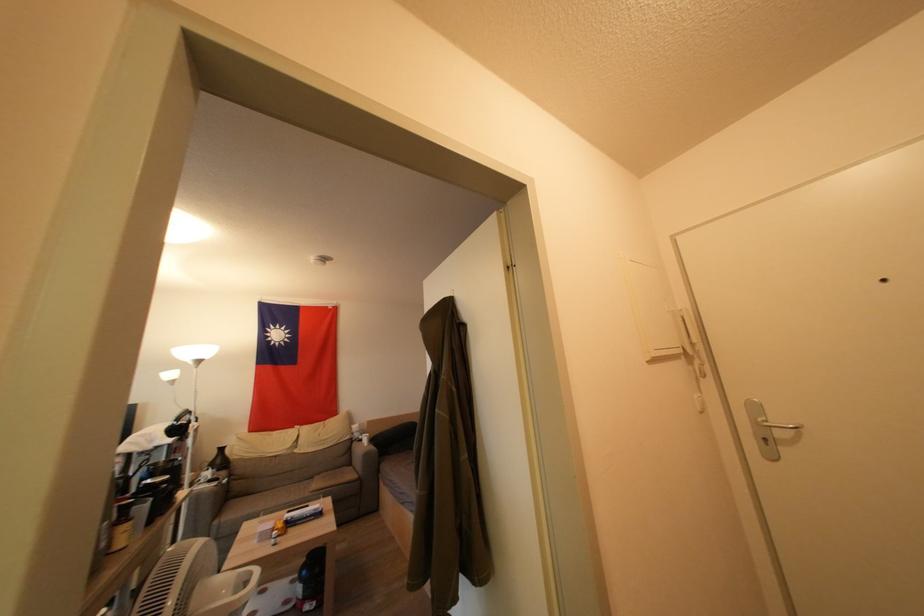
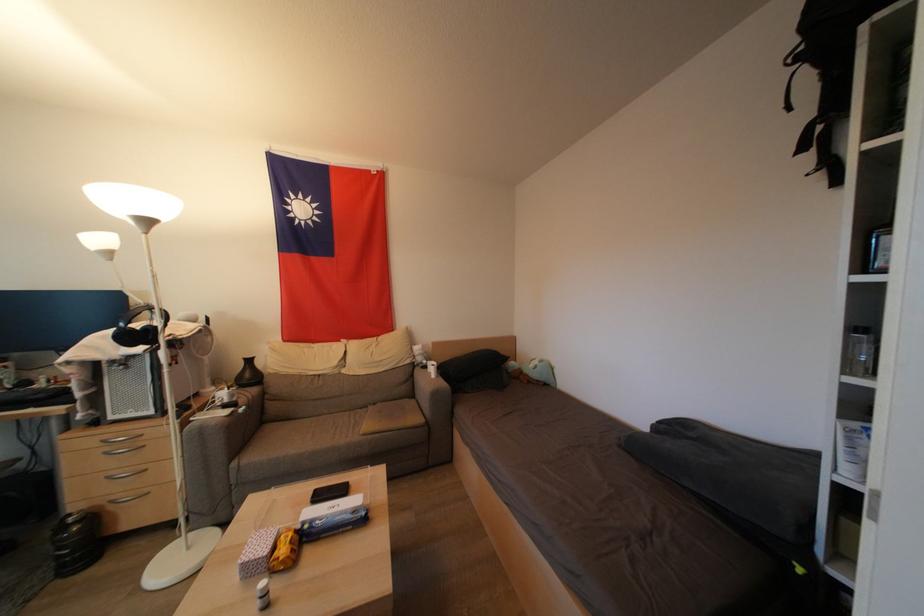
What movement of the cameraman would produce the second image?

The cameraman walked toward left, forward.